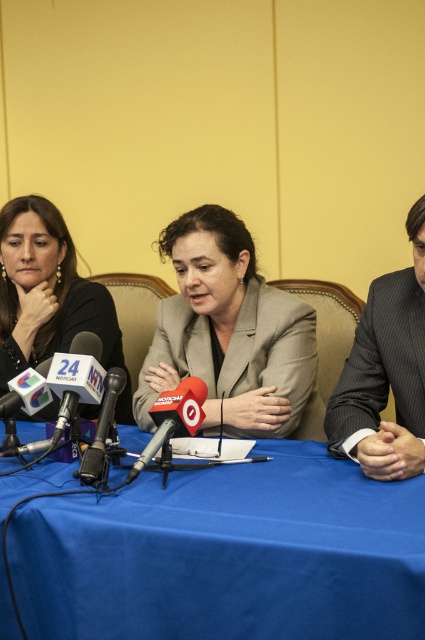
Based on the photo, you are attending a press conference and need to sit down. There is a seat available at point (x=385, y=372). Which object in the scene is located at that point?

The gray pinstripe suit at right is located at point (x=385, y=372).

You are standing in the room where this press conference is taking place. You need to hand a document to the person in the gray pinstripe suit at right. If you are currently 2 meters away from the nearest wall, can you reach them without moving closer than 1 meter from the wall?

The gray pinstripe suit at right is 1.15 meters away from the viewer. Since you are 2 meters away from the nearest wall, subtracting the 1 meter minimum distance required, you have 1 meter available to move towards the suit. However, the distance to the suit is 1.15 meters, which exceeds the 1 meter you can move. Therefore, you cannot reach them without violating the 1 meter wall boundary.